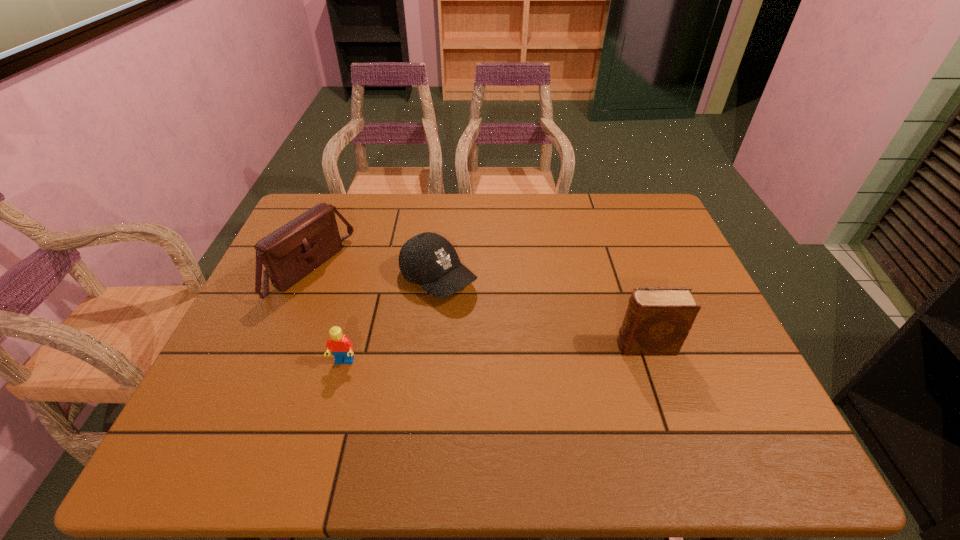
Locate an element on the screen. vacant space located on the front flap of the leftmost object is located at coordinates (404, 322).

Locate an element on the screen. The height and width of the screenshot is (540, 960). vacant area situated 0.110m on the front-facing side of the third object from left to right is located at coordinates (493, 323).

I want to click on free point located 0.080m on the front-facing side of the third object from left to right, so click(485, 316).

Where is `vacant space located on the front-facing side of the third object from left to right`? vacant space located on the front-facing side of the third object from left to right is located at coordinates (511, 336).

Image resolution: width=960 pixels, height=540 pixels. In order to click on object positioned at the left edge in this screenshot , I will do `click(291, 252)`.

Locate an element on the screen. Image resolution: width=960 pixels, height=540 pixels. object located at the right edge is located at coordinates (657, 321).

Where is `vacant region at the far edge of the desktop`? vacant region at the far edge of the desktop is located at coordinates (574, 215).

The width and height of the screenshot is (960, 540). What are the coordinates of `blank area at the near edge` in the screenshot? It's located at (460, 394).

Identify the location of free region at the left edge. This screenshot has height=540, width=960. (322, 281).

This screenshot has width=960, height=540. In the image, there is a desktop. Identify the location of vacant space at the right edge. (670, 248).